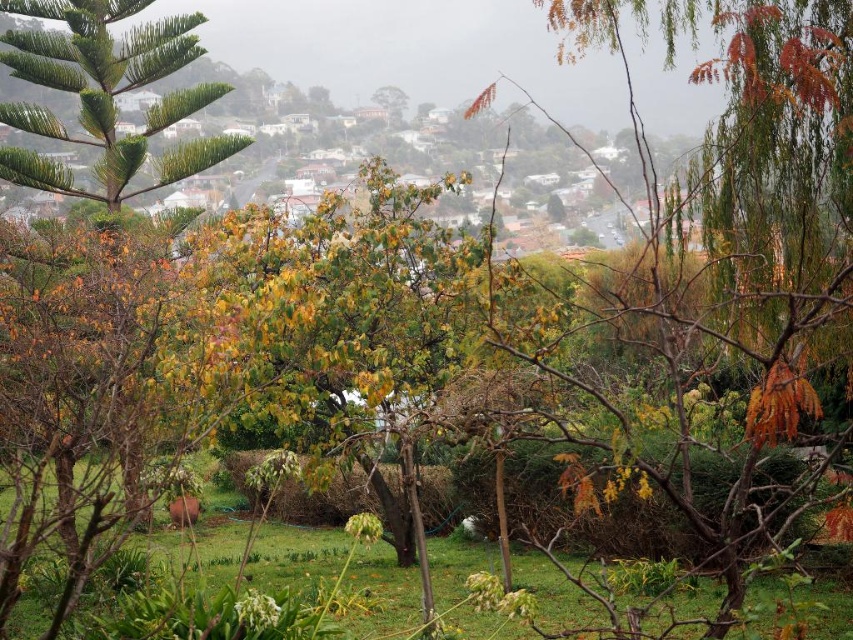
Is point (380, 634) closer to viewer compared to point (387, 99)?

Yes.

Is green grass at center above green leafy tree at upper center?

No, green grass at center is not above green leafy tree at upper center.

Is point (537, 564) closer to viewer compared to point (373, 97)?

Yes, point (537, 564) is closer to viewer.

Where is `green grass at center`? This screenshot has width=853, height=640. green grass at center is located at coordinates (294, 556).